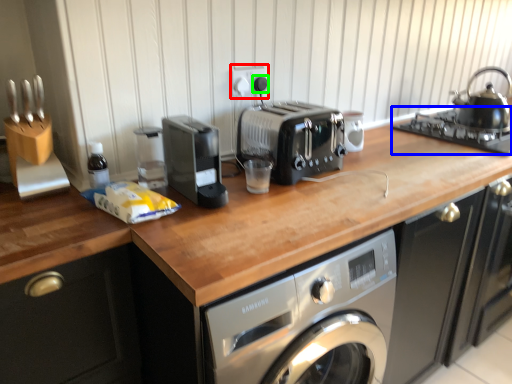
Question: Considering the real-world distances, which object is farthest from electric outlet (highlighted by a red box)? gas stove (highlighted by a blue box) or knob (highlighted by a green box)?

Choices:
 (A) gas stove
 (B) knob

Answer: (A)